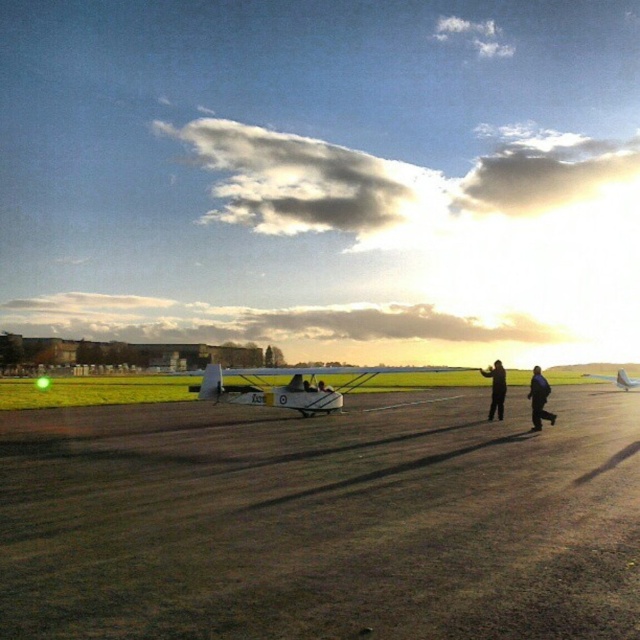
Describe the element at coordinates (323, 522) in the screenshot. This screenshot has height=640, width=640. I see `dirt/gritty runway at center` at that location.

Who is taller, dirt/gritty runway at center or black matte jacket at center?

Standing taller between the two is black matte jacket at center.

Who is more distant from viewer, [80,625] or [502,372]?

Positioned behind is point [502,372].

You are a GUI agent. You are given a task and a screenshot of the screen. Output one action in this format:
    pyautogui.click(x=<x>, y=<y>)
    Task: Click on the dirt/gritty runway at center
    
    Given the screenshot: What is the action you would take?
    pyautogui.click(x=323, y=522)

Measure the distance from dark blue jeans at center to black matte jacket at center.

dark blue jeans at center and black matte jacket at center are 5.86 feet apart from each other.

Does dark blue jeans at center have a greater height compared to black matte jacket at center?

In fact, dark blue jeans at center may be shorter than black matte jacket at center.

Where is `dark blue jeans at center`? This screenshot has height=640, width=640. dark blue jeans at center is located at coordinates (538, 400).

Is white matte airplane at center positioned behind metallic silver airplane at center?

No, white matte airplane at center is closer to the viewer.

Between point (369, 376) and point (618, 376), which one is positioned in front?

Point (369, 376) is more forward.

Identify the location of white matte airplane at center. (269, 394).